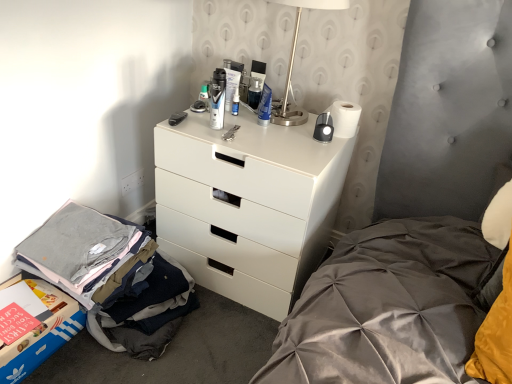
In order to click on vacant space in between matte black shaving cream can at center, acting as the 4th toiletry starting from the right, and translucent plastic bottle at upper center, the 1th toiletry from the left in this screenshot , I will do tap(207, 119).